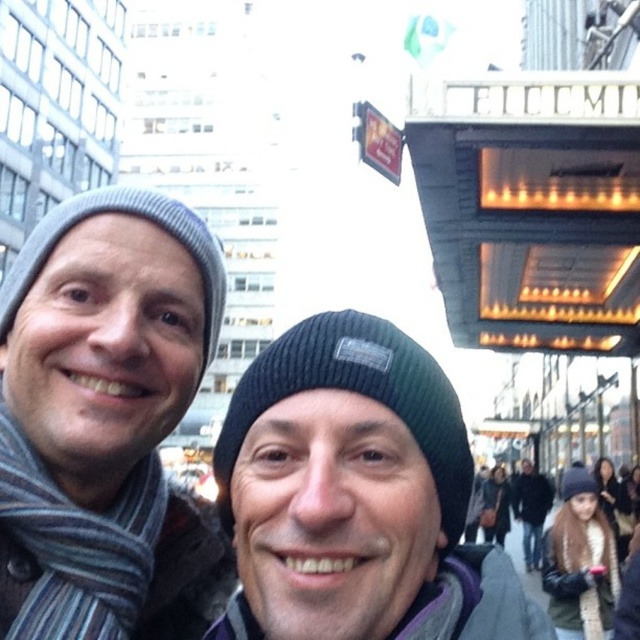
Question: Estimate the real-world distances between objects in this image. Which object is closer to the gray knit beanie at left?

Choices:
 (A) striped wool scarf at left
 (B) black knit beanie at center
 (C) black woolen hat at lower right

Answer: (A)

Question: Based on their relative distances, which object is nearer to the brown fur coat at lower right?

Choices:
 (A) gray knit beanie at left
 (B) black woolen hat at lower right

Answer: (B)

Question: Estimate the real-world distances between objects in this image. Which object is farther from the gray knit beanie at left?

Choices:
 (A) striped wool scarf at left
 (B) black woolen hat at lower right
 (C) brown fur coat at lower right

Answer: (B)

Question: Is black knit beanie at center behind gray knit beanie at left?

Choices:
 (A) yes
 (B) no

Answer: (A)

Question: Does gray knit beanie at left have a larger size compared to striped wool scarf at left?

Choices:
 (A) yes
 (B) no

Answer: (A)

Question: Can you confirm if gray knit beanie at left is positioned to the left of black woolen hat at lower right?

Choices:
 (A) yes
 (B) no

Answer: (A)